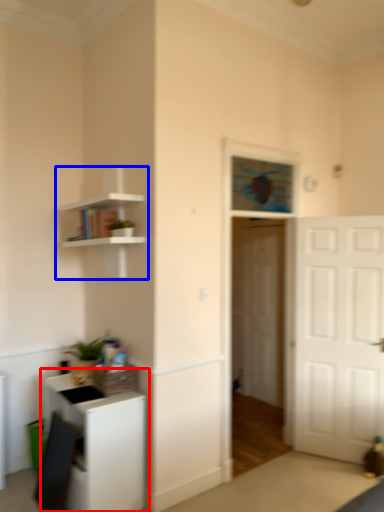
Question: Which of the following is the farthest to the observer, cabinetry (highlighted by a red box) or shelf (highlighted by a blue box)?

Choices:
 (A) cabinetry
 (B) shelf

Answer: (B)